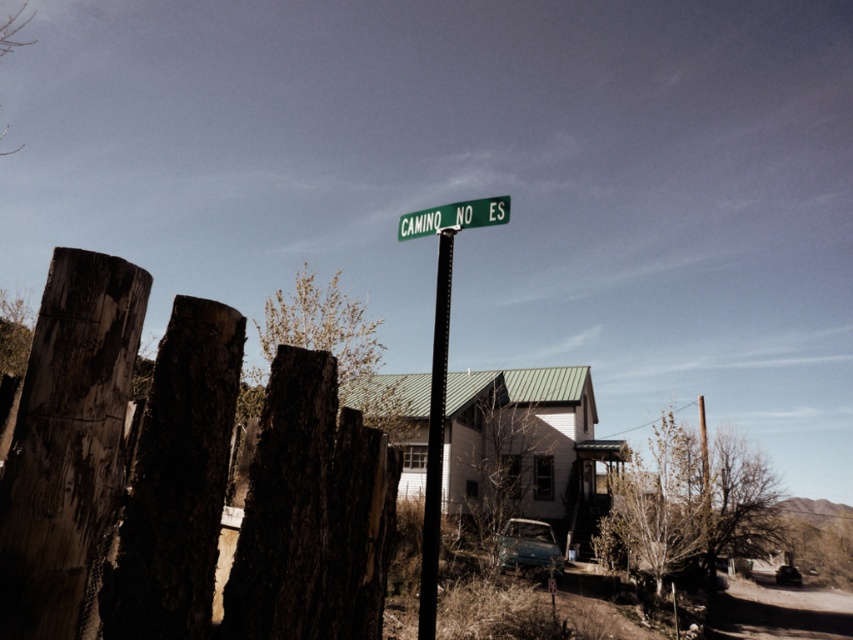
You are standing in the middle of the scene looking towards the house. Where is the weathered wood fence at left located relative to your position?

The weathered wood fence at left is located to the left side of the scene, positioned at coordinates approximately 0.675 on the x axis and 0.079 on the y axis.

You are driving a teal matte car at center and want to park it next to the weathered wood fence at left. Is the fence on the left side of your car?

Yes, the weathered wood fence at left is positioned on the left side of the teal matte car at center, so parking there would place the car next to the fence on its left side.

You are standing in front of the weathered wood fence at left and want to reach the green matte street sign at upper center. Which direction should you move to get closer to the sign?

You should move forward towards the green matte street sign at upper center because the weathered wood fence at left is closer to you than the sign, so moving forward will bring you nearer to the sign.